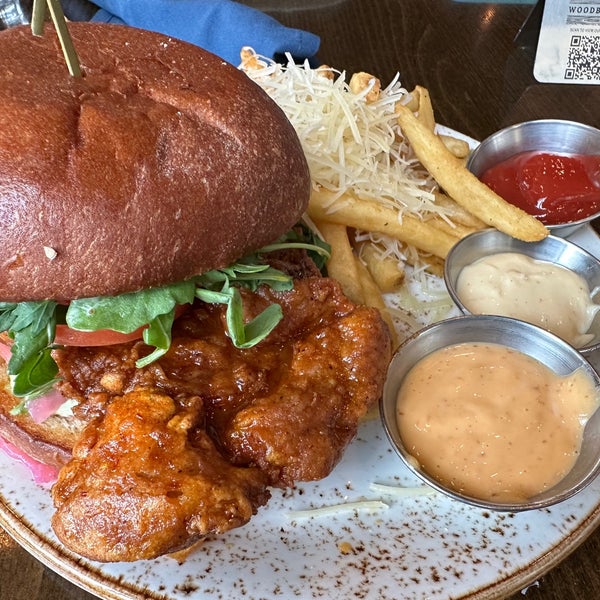
Locate an element on the screen. This screenshot has width=600, height=600. blue napkin/towel is located at coordinates (220, 29).